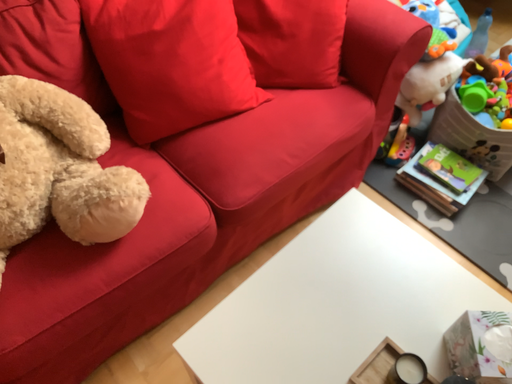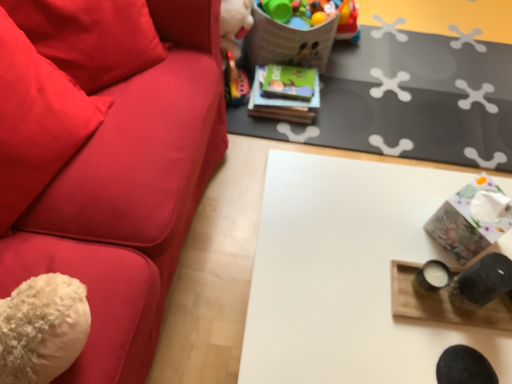
Question: How did the camera likely rotate when shooting the video?

Choices:
 (A) rotated right
 (B) rotated left

Answer: (A)